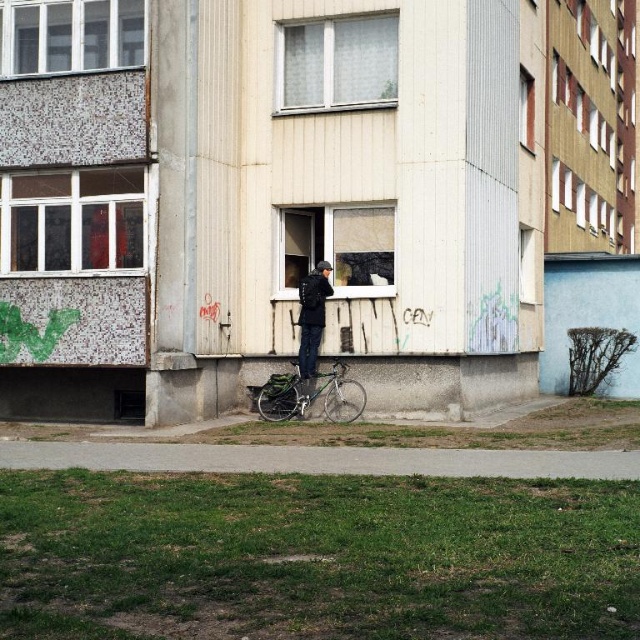
Question: Is shiny metallic bicycle at center positioned at the back of dark blue fabric jacket at center?

Choices:
 (A) yes
 (B) no

Answer: (B)

Question: Observing the image, what is the correct spatial positioning of shiny metallic bicycle at center in reference to dark blue fabric jacket at center?

Choices:
 (A) below
 (B) above

Answer: (A)

Question: Among these objects, which one is nearest to the camera?

Choices:
 (A) dark blue fabric jacket at center
 (B) shiny metallic bicycle at center

Answer: (B)

Question: Does shiny metallic bicycle at center appear under dark blue fabric jacket at center?

Choices:
 (A) no
 (B) yes

Answer: (B)